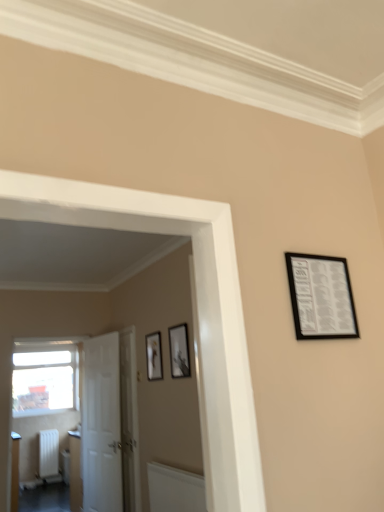
Question: From a real-world perspective, is matte black picture frame at center, the third picture frame viewed from the front, below black matte picture frame at upper right, placed as the 1th picture frame when sorted from top to bottom?

Choices:
 (A) no
 (B) yes

Answer: (B)

Question: Can you confirm if matte black picture frame at center, which ranks as the 1th picture frame in back-to-front order, is shorter than black matte picture frame at upper right, the 3th picture frame positioned from the back?

Choices:
 (A) no
 (B) yes

Answer: (A)

Question: Is matte black picture frame at center, which ranks as the 1th picture frame in back-to-front order, bigger than black matte picture frame at upper right, which is counted as the first picture frame, starting from the right?

Choices:
 (A) no
 (B) yes

Answer: (B)

Question: Is matte black picture frame at center, the third picture frame viewed from the front, not within black matte picture frame at upper right, the 3th picture frame viewed from the left?

Choices:
 (A) no
 (B) yes

Answer: (B)

Question: Is matte black picture frame at center, which ranks as the 1th picture frame in back-to-front order, not close to black matte picture frame at upper right, the 3th picture frame viewed from the left?

Choices:
 (A) yes
 (B) no

Answer: (A)

Question: From the image's perspective, is matte black picture frame at center, which is counted as the third picture frame, starting from the right, below black matte picture frame at upper right, which is counted as the first picture frame, starting from the right?

Choices:
 (A) no
 (B) yes

Answer: (B)

Question: Does transparent glass window at left have a greater width compared to matte black picture frame at center, the third picture frame when ordered from top to bottom?

Choices:
 (A) yes
 (B) no

Answer: (A)

Question: Does transparent glass window at left lie in front of matte black picture frame at center, which is counted as the third picture frame, starting from the right?

Choices:
 (A) yes
 (B) no

Answer: (B)

Question: Is transparent glass window at left to the right of matte black picture frame at center, the 1th picture frame in the bottom-to-top sequence, from the viewer's perspective?

Choices:
 (A) yes
 (B) no

Answer: (B)

Question: Is transparent glass window at left taller than matte black picture frame at center, arranged as the 1th picture frame when viewed from the left?

Choices:
 (A) yes
 (B) no

Answer: (A)

Question: From the image's perspective, is transparent glass window at left on matte black picture frame at center, which is counted as the third picture frame, starting from the right?

Choices:
 (A) yes
 (B) no

Answer: (B)

Question: Is transparent glass window at left behind matte black picture frame at center, the 1th picture frame in the bottom-to-top sequence?

Choices:
 (A) no
 (B) yes

Answer: (B)

Question: Can you confirm if matte white radiator at lower left is smaller than white matte radiator at lower left?

Choices:
 (A) yes
 (B) no

Answer: (A)